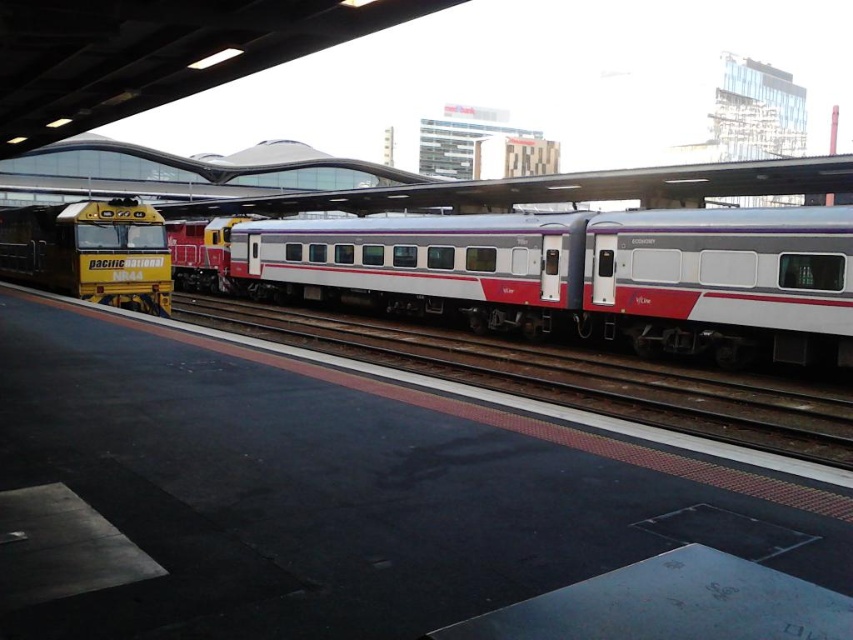
Does silver metallic train car at center have a lesser width compared to yellow painted metal locomotive at left?

Incorrect, silver metallic train car at center's width is not less than yellow painted metal locomotive at left's.

Can you confirm if silver metallic train car at center is positioned above yellow painted metal locomotive at left?

No, silver metallic train car at center is not above yellow painted metal locomotive at left.

Image resolution: width=853 pixels, height=640 pixels. Identify the location of silver metallic train car at center. (579, 275).

Who is more distant from viewer, (612, 385) or (170, 282)?

Point (170, 282)

Who is positioned more to the left, metallic train track at center or yellow painted metal locomotive at left?

yellow painted metal locomotive at left is more to the left.

Does point (579, 387) lie in front of point (64, 268)?

Yes, it is.

Identify the location of metallic train track at center. This screenshot has height=640, width=853. (560, 376).

Which is above, silver metallic train car at center or metallic train track at center?

Positioned higher is silver metallic train car at center.

Does silver metallic train car at center appear on the right side of metallic train track at center?

No, silver metallic train car at center is not to the right of metallic train track at center.

Locate an element on the screen. silver metallic train car at center is located at coordinates (579, 275).